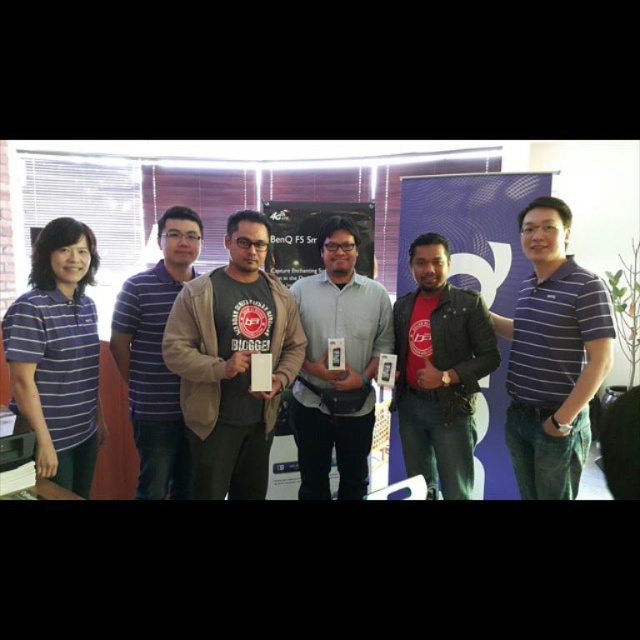
You are organizing a photo shoot and need to ensure that all participants are visible. The purple striped polo shirt at center and the blue striped shirt at left are in the same frame. Which participant should you adjust to avoid overlapping?

The purple striped polo shirt at center is positioned over the blue striped shirt at left, so you should adjust the participant wearing the purple striped polo shirt at center to move it out of the way to ensure both are visible.

You are organizing a photo shoot and need to ensure that the purple striped polo shirt at center and the red matte jacket at center are visible. Based on their positions, which clothing item is closer to the camera?

The purple striped polo shirt at center is closer to the camera because it is in front of the red matte jacket at center.